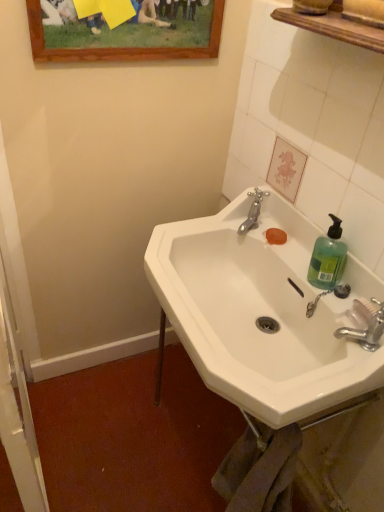
What do you see at coordinates (328, 257) in the screenshot? I see `green translucent plastic at right` at bounding box center [328, 257].

Find the location of `white ceramic sink at center`. white ceramic sink at center is located at coordinates (261, 312).

Find the location of `silver metallic faucet at upper center, the 2th tap in the bottom-to-top sequence`. silver metallic faucet at upper center, the 2th tap in the bottom-to-top sequence is located at coordinates (253, 211).

How much space does silver metallic faucet at lower right, which ranks as the 1th tap in front-to-back order, occupy vertically?

4.84 inches.

At what (x,y) coordinates should I click in order to perform the action: click on green translucent plastic at right. Please return your answer as a coordinate pair (x, y). The height and width of the screenshot is (512, 384). Looking at the image, I should click on click(x=328, y=257).

From a real-world perspective, relative to white glossy screen door at left, is white ceramic sink at center vertically above or below?

In terms of real-world spatial position, white ceramic sink at center is above white glossy screen door at left.

Is white ceramic sink at center positioned beyond the bounds of white glossy screen door at left?

white ceramic sink at center is positioned outside white glossy screen door at left.

Which object is closer to the camera, white ceramic sink at center or white glossy screen door at left?

white glossy screen door at left is more forward.

Considering the sizes of silver metallic faucet at upper center, arranged as the 2th tap when viewed from the front, and green translucent plastic at right in the image, is silver metallic faucet at upper center, arranged as the 2th tap when viewed from the front, wider or thinner than green translucent plastic at right?

Considering their sizes, silver metallic faucet at upper center, arranged as the 2th tap when viewed from the front, looks broader than green translucent plastic at right.

Which object is further away from the camera, silver metallic faucet at upper center, placed as the first tap when sorted from back to front, or green translucent plastic at right?

silver metallic faucet at upper center, placed as the first tap when sorted from back to front, is behind.

Are silver metallic faucet at upper center, the 2th tap in the bottom-to-top sequence, and green translucent plastic at right located far from each other?

No, silver metallic faucet at upper center, the 2th tap in the bottom-to-top sequence, is in close proximity to green translucent plastic at right.

Considering the positions of point (245, 220) and point (310, 269), is point (245, 220) closer or farther from the camera than point (310, 269)?

Point (245, 220) appears to be farther away from the viewer than point (310, 269).

From a real-world perspective, does green translucent plastic at right sit lower than white glossy screen door at left?

No, from a real-world perspective, green translucent plastic at right is not under white glossy screen door at left.

From the image's perspective, would you say green translucent plastic at right is shown under white glossy screen door at left?

Incorrect, from the image's perspective, green translucent plastic at right is higher than white glossy screen door at left.

How different are the orientations of green translucent plastic at right and white glossy screen door at left in degrees?

They differ by 1.38 degrees in their facing directions.

Is green translucent plastic at right wider than white glossy screen door at left?

In fact, green translucent plastic at right might be narrower than white glossy screen door at left.

In the scene shown: Is wooden picture frame at upper center inside white glossy screen door at left?

Definitely not — wooden picture frame at upper center is not inside white glossy screen door at left.

Between white glossy screen door at left and wooden picture frame at upper center, which one appears on the right side from the viewer's perspective?

wooden picture frame at upper center is more to the right.

Is point (16, 402) positioned in front of point (78, 32)?

That is True.

Locate an element on the screen. screen door lying below the wooden picture frame at upper center (from the image's perspective) is located at coordinates (18, 414).

Between silver metallic faucet at lower right, acting as the 1th tap starting from the bottom, and silver metallic faucet at upper center, the 2th tap in the bottom-to-top sequence, which one has smaller size?

silver metallic faucet at upper center, the 2th tap in the bottom-to-top sequence.

From the image's perspective, relative to silver metallic faucet at upper center, arranged as the 2th tap when viewed from the front, is silver metallic faucet at lower right, the second tap from the top, above or below?

silver metallic faucet at lower right, the second tap from the top, is below silver metallic faucet at upper center, arranged as the 2th tap when viewed from the front.

Which is behind, point (381, 334) or point (252, 213)?

Point (252, 213)

Is silver metallic faucet at upper center, the 2th tap in the bottom-to-top sequence, directly adjacent to silver metallic faucet at lower right, the second tap from the top?

They are not placed beside each other.

Is silver metallic faucet at lower right, the second tap from the top, completely or partially inside silver metallic faucet at upper center, the 1th tap positioned from the left?

No, silver metallic faucet at lower right, the second tap from the top, is not surrounded by silver metallic faucet at upper center, the 1th tap positioned from the left.

Which of these two, silver metallic faucet at upper center, placed as the second tap when sorted from right to left, or silver metallic faucet at lower right, acting as the 1th tap starting from the bottom, is bigger?

With larger size is silver metallic faucet at lower right, acting as the 1th tap starting from the bottom.

Looking at this image, considering the sizes of objects silver metallic faucet at upper center, the 1th tap positioned from the left, and silver metallic faucet at lower right, which ranks as the 1th tap in front-to-back order, in the image provided, who is shorter, silver metallic faucet at upper center, the 1th tap positioned from the left, or silver metallic faucet at lower right, which ranks as the 1th tap in front-to-back order,?

silver metallic faucet at lower right, which ranks as the 1th tap in front-to-back order.

Can you tell me how much wooden picture frame at upper center and green translucent plastic at right differ in facing direction?

There is a 88.5-degree angle between the facing directions of wooden picture frame at upper center and green translucent plastic at right.

From the image's perspective, which is below, wooden picture frame at upper center or green translucent plastic at right?

green translucent plastic at right is shown below in the image.

Can we say wooden picture frame at upper center lies outside green translucent plastic at right?

Absolutely, wooden picture frame at upper center is external to green translucent plastic at right.

In order to click on picture frame lying on the left of green translucent plastic at right in this screenshot , I will do `click(124, 29)`.

You are a GUI agent. You are given a task and a screenshot of the screen. Output one action in this format:
    pyautogui.click(x=<x>, y=<y>)
    Task: Click on the screen door located in front of the white ceramic sink at center
    The width and height of the screenshot is (384, 512).
    Given the screenshot: What is the action you would take?
    pyautogui.click(x=18, y=414)

Find the location of a particular element. The image size is (384, 512). soap dispenser located above the silver metallic faucet at upper center, the first tap viewed from the top (from a real-world perspective) is located at coordinates (328, 257).

Based on their spatial positions, is green translucent plastic at right or white glossy screen door at left further from white ceramic sink at center?

Among the two, white glossy screen door at left is located further to white ceramic sink at center.

Considering their positions, is silver metallic faucet at upper center, the first tap viewed from the top, positioned further to green translucent plastic at right than wooden picture frame at upper center?

Among the two, wooden picture frame at upper center is located further to green translucent plastic at right.

Based on their spatial positions, is wooden picture frame at upper center or silver metallic faucet at upper center, the 1th tap positioned from the left, closer to green translucent plastic at right?

silver metallic faucet at upper center, the 1th tap positioned from the left.

Estimate the real-world distances between objects in this image. Which object is closer to white glossy screen door at left, wooden picture frame at upper center or white ceramic sink at center?

The object closer to white glossy screen door at left is white ceramic sink at center.

Looking at the image, which one is located further to white ceramic sink at center, silver metallic faucet at lower right, acting as the 1th tap starting from the bottom, or white glossy screen door at left?

Among the two, white glossy screen door at left is located further to white ceramic sink at center.

Looking at the image, which one is located further to green translucent plastic at right, wooden picture frame at upper center or white ceramic sink at center?

wooden picture frame at upper center is positioned further to the anchor green translucent plastic at right.

Based on their spatial positions, is green translucent plastic at right or silver metallic faucet at lower right, the first tap positioned from the right, closer to wooden picture frame at upper center?

green translucent plastic at right is positioned closer to the anchor wooden picture frame at upper center.

Considering their positions, is silver metallic faucet at upper center, arranged as the 2th tap when viewed from the front, positioned further to silver metallic faucet at lower right, acting as the 1th tap starting from the bottom, than green translucent plastic at right?

silver metallic faucet at upper center, arranged as the 2th tap when viewed from the front, lies further to silver metallic faucet at lower right, acting as the 1th tap starting from the bottom, than the other object.

The height and width of the screenshot is (512, 384). Identify the location of tap between white glossy screen door at left and silver metallic faucet at lower right, acting as the 1th tap starting from the bottom, in the horizontal direction. (253, 211).

Find the location of a particular element. The width and height of the screenshot is (384, 512). soap dispenser between wooden picture frame at upper center and silver metallic faucet at lower right, the first tap positioned from the right, in the vertical direction is located at coordinates (328, 257).

Where is `soap dispenser between white glossy screen door at left and silver metallic faucet at lower right, the second tap from the top, in the horizontal direction`? The width and height of the screenshot is (384, 512). soap dispenser between white glossy screen door at left and silver metallic faucet at lower right, the second tap from the top, in the horizontal direction is located at coordinates (328, 257).

Where is `tap that lies between wooden picture frame at upper center and silver metallic faucet at lower right, which ranks as the 1th tap in front-to-back order, from top to bottom`? tap that lies between wooden picture frame at upper center and silver metallic faucet at lower right, which ranks as the 1th tap in front-to-back order, from top to bottom is located at coordinates (253, 211).